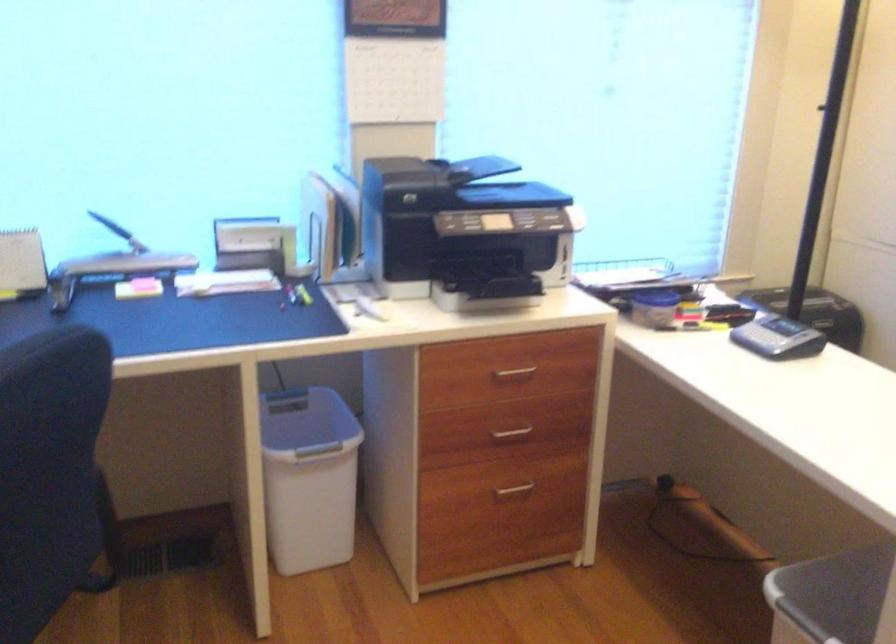
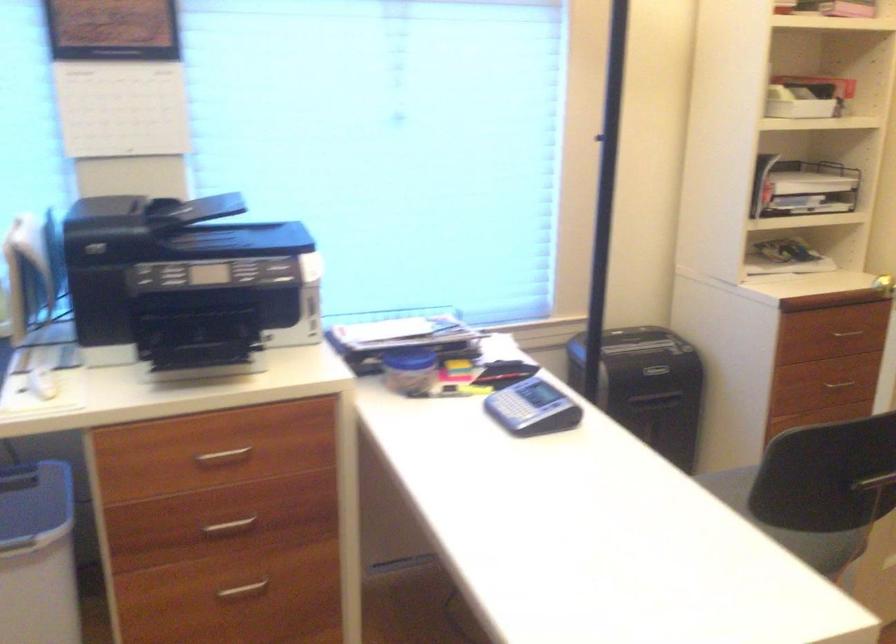
Question: How did the camera likely rotate?

Choices:
 (A) Left
 (B) Right
 (C) Up
 (D) Down

Answer: (B)